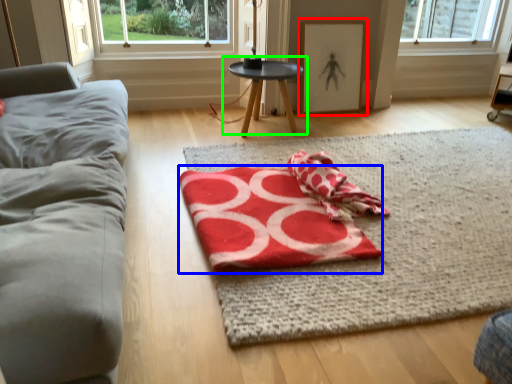
Question: Estimate the real-world distances between objects in this image. Which object is farther from picture frame (highlighted by a red box), beach towel (highlighted by a blue box) or table (highlighted by a green box)?

Choices:
 (A) beach towel
 (B) table

Answer: (A)